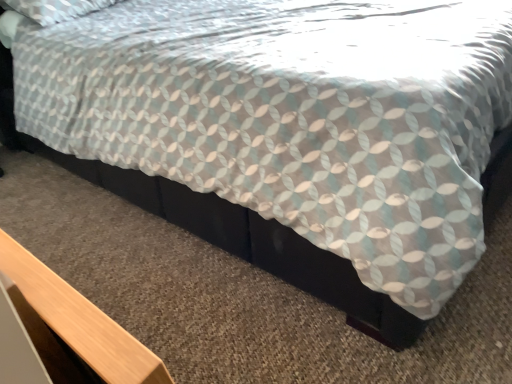
Question: Can you confirm if light wood table at lower left is taller than black matte bed frame at lower center?

Choices:
 (A) yes
 (B) no

Answer: (A)

Question: Considering the relative sizes of light wood table at lower left and black matte bed frame at lower center in the image provided, is light wood table at lower left bigger than black matte bed frame at lower center?

Choices:
 (A) yes
 (B) no

Answer: (B)

Question: Considering the relative positions of light wood table at lower left and black matte bed frame at lower center in the image provided, is light wood table at lower left to the left of black matte bed frame at lower center from the viewer's perspective?

Choices:
 (A) no
 (B) yes

Answer: (B)

Question: Is light wood table at lower left oriented towards black matte bed frame at lower center?

Choices:
 (A) no
 (B) yes

Answer: (B)

Question: From the image's perspective, does light wood table at lower left appear higher than black matte bed frame at lower center?

Choices:
 (A) no
 (B) yes

Answer: (A)

Question: Considering the relative sizes of light wood table at lower left and black matte bed frame at lower center in the image provided, is light wood table at lower left smaller than black matte bed frame at lower center?

Choices:
 (A) yes
 (B) no

Answer: (A)

Question: Is black matte bed frame at lower center oriented towards light wood table at lower left?

Choices:
 (A) no
 (B) yes

Answer: (A)

Question: Is black matte bed frame at lower center not near light wood table at lower left?

Choices:
 (A) no
 (B) yes

Answer: (A)

Question: From a real-world perspective, is black matte bed frame at lower center located higher than light wood table at lower left?

Choices:
 (A) no
 (B) yes

Answer: (A)

Question: From a real-world perspective, is black matte bed frame at lower center beneath light wood table at lower left?

Choices:
 (A) yes
 (B) no

Answer: (A)

Question: From the image's perspective, is black matte bed frame at lower center on light wood table at lower left?

Choices:
 (A) no
 (B) yes

Answer: (B)

Question: Is black matte bed frame at lower center to the left of light wood table at lower left from the viewer's perspective?

Choices:
 (A) yes
 (B) no

Answer: (B)

Question: From a real-world perspective, relative to light wood table at lower left, is black matte bed frame at lower center vertically above or below?

Choices:
 (A) above
 (B) below

Answer: (B)